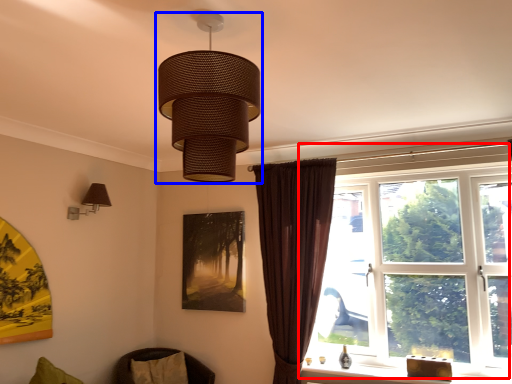
Question: Among these objects, which one is nearest to the camera, window (highlighted by a red box) or lamp (highlighted by a blue box)?

Choices:
 (A) window
 (B) lamp

Answer: (B)